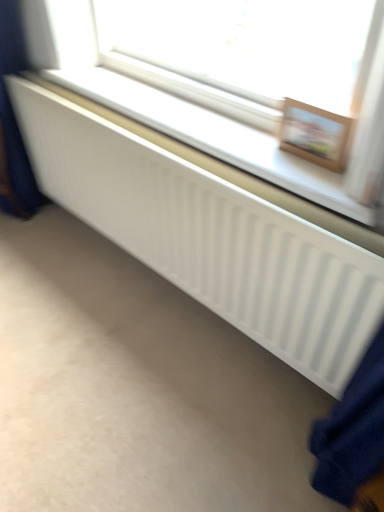
Question: Is wooden picture frame at upper right facing away from white matte radiator at center?

Choices:
 (A) yes
 (B) no

Answer: (B)

Question: Is wooden picture frame at upper right taller than white matte radiator at center?

Choices:
 (A) no
 (B) yes

Answer: (B)

Question: Considering the relative sizes of wooden picture frame at upper right and white matte radiator at center in the image provided, is wooden picture frame at upper right smaller than white matte radiator at center?

Choices:
 (A) yes
 (B) no

Answer: (A)

Question: Is wooden picture frame at upper right not within white matte radiator at center?

Choices:
 (A) yes
 (B) no

Answer: (A)

Question: Considering the relative sizes of wooden picture frame at upper right and white matte radiator at center in the image provided, is wooden picture frame at upper right wider than white matte radiator at center?

Choices:
 (A) no
 (B) yes

Answer: (A)

Question: Is wooden picture frame at upper right facing towards white matte radiator at center?

Choices:
 (A) yes
 (B) no

Answer: (B)

Question: Is white matte radiator at center not close to wooden picture frame at upper right?

Choices:
 (A) yes
 (B) no

Answer: (B)

Question: Considering the relative sizes of white matte radiator at center and wooden picture frame at upper right in the image provided, is white matte radiator at center smaller than wooden picture frame at upper right?

Choices:
 (A) no
 (B) yes

Answer: (A)

Question: Is white matte radiator at center to the left of wooden picture frame at upper right from the viewer's perspective?

Choices:
 (A) yes
 (B) no

Answer: (A)

Question: Does white matte radiator at center have a larger size compared to wooden picture frame at upper right?

Choices:
 (A) yes
 (B) no

Answer: (A)

Question: Can you confirm if white matte radiator at center is taller than wooden picture frame at upper right?

Choices:
 (A) yes
 (B) no

Answer: (B)

Question: Is wooden picture frame at upper right at the back of white matte radiator at center?

Choices:
 (A) yes
 (B) no

Answer: (B)

Question: From the image's perspective, is wooden picture frame at upper right positioned above or below white matte radiator at center?

Choices:
 (A) below
 (B) above

Answer: (A)